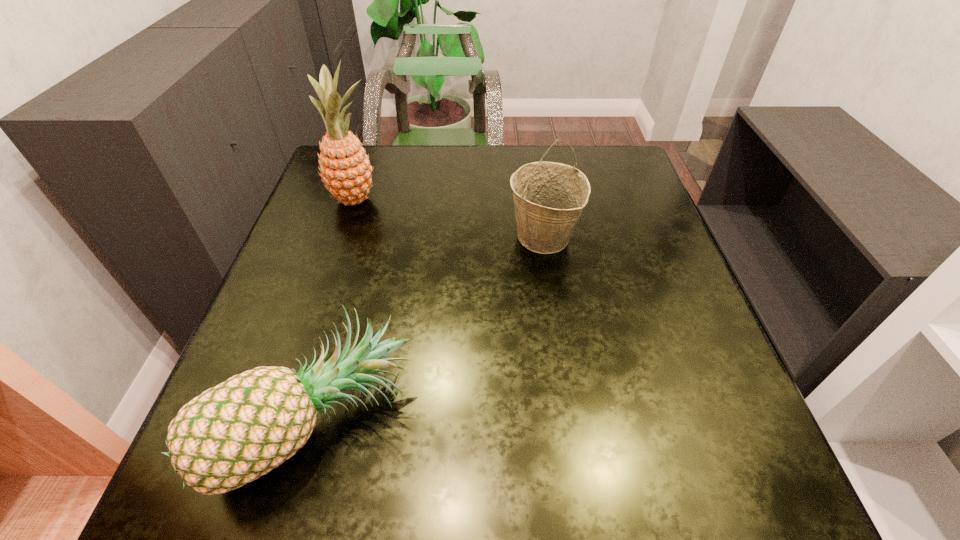
Where is `the farther pineapple`? The image size is (960, 540). the farther pineapple is located at coordinates (345, 168).

Locate an element on the screen. The height and width of the screenshot is (540, 960). the taller pineapple is located at coordinates (345, 168).

Where is `the second tallest object`? Image resolution: width=960 pixels, height=540 pixels. the second tallest object is located at coordinates (549, 197).

Find the location of a particular element. the rightmost object is located at coordinates (549, 197).

Locate an element on the screen. The width and height of the screenshot is (960, 540). the shortest object is located at coordinates (231, 434).

This screenshot has width=960, height=540. I want to click on the nearer pineapple, so click(231, 434).

The width and height of the screenshot is (960, 540). I want to click on free spot located on the front of the taller pineapple, so click(341, 242).

Where is `free point located on the left of the wine bucket`? free point located on the left of the wine bucket is located at coordinates (431, 237).

Where is `vacant space located 0.370m on the back of the shorter pineapple`? vacant space located 0.370m on the back of the shorter pineapple is located at coordinates (370, 222).

This screenshot has height=540, width=960. In order to click on object present at the far edge in this screenshot , I will do `click(345, 168)`.